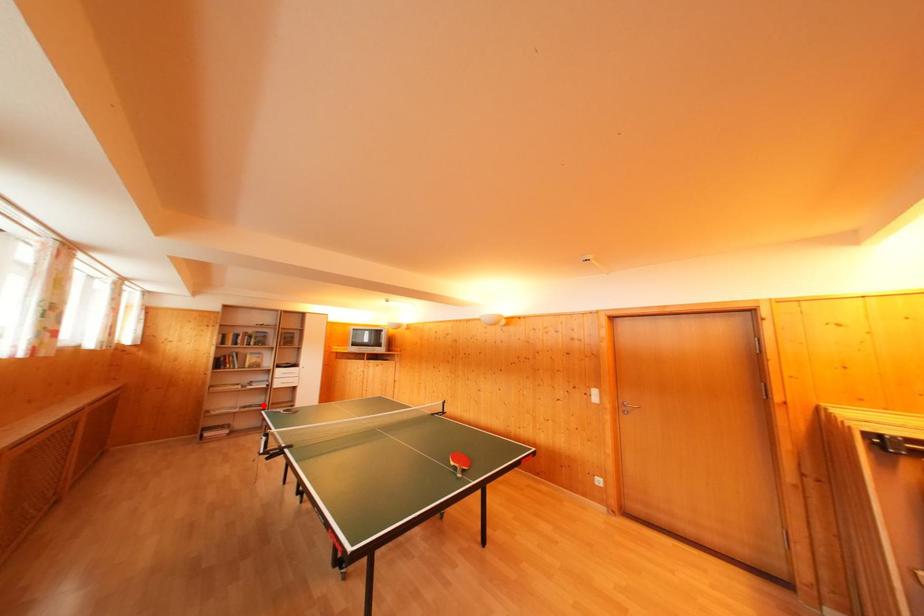
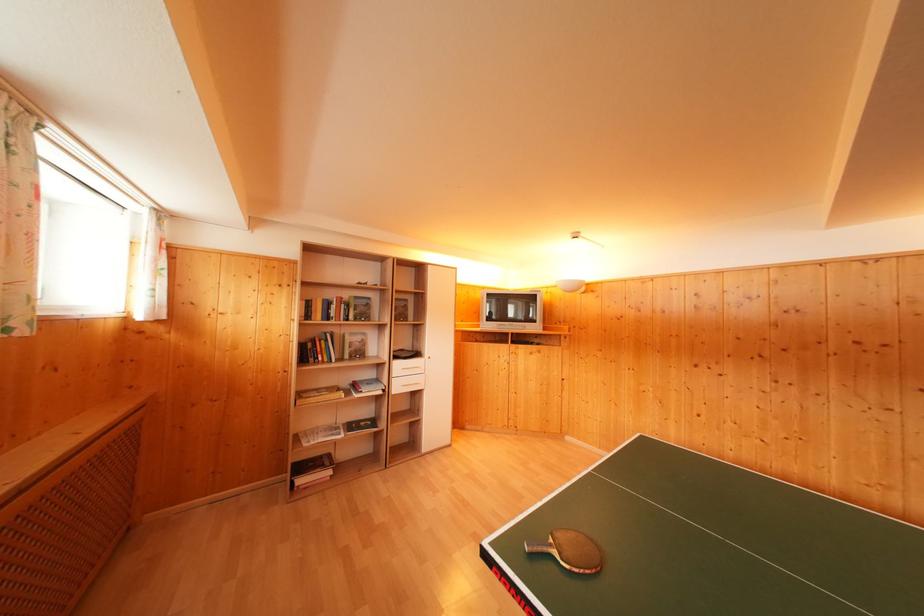
The point at the highlighted location is marked in the first image. Where is the corresponding point in the second image?

(371, 416)